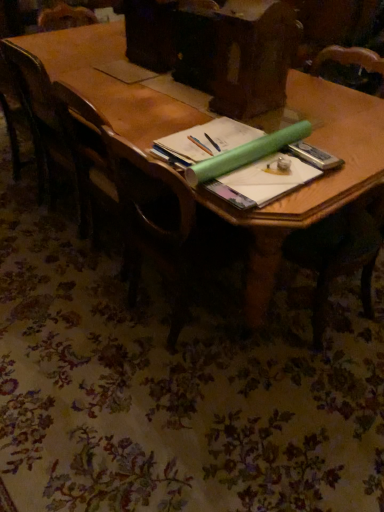
Question: Looking at the image, does wooden chair at center, which appears as the second chair when viewed from the back, seem bigger or smaller compared to wooden chair at left, positioned as the first chair in left-to-right order?

Choices:
 (A) small
 (B) big

Answer: (A)

Question: From a real-world perspective, is wooden chair at center, the 1th chair viewed from the right, physically located above or below wooden chair at left, positioned as the 2th chair in front-to-back order?

Choices:
 (A) below
 (B) above

Answer: (A)

Question: Considering the real-world distances, which object is closest to the wooden chair at left, positioned as the first chair in left-to-right order?

Choices:
 (A) wooden chair at center, which is the second chair in left-to-right order
 (B) wooden table at center

Answer: (B)

Question: Based on their relative distances, which object is farther from the wooden chair at left, the first chair in the back-to-front sequence?

Choices:
 (A) wooden chair at center, which is the second chair in left-to-right order
 (B) wooden table at center

Answer: (A)